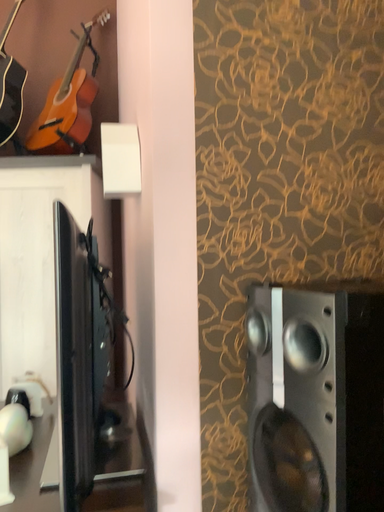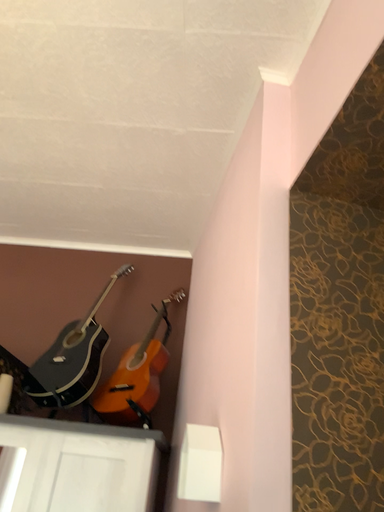
Question: Which way did the camera rotate in the video?

Choices:
 (A) rotated upward
 (B) rotated downward

Answer: (A)